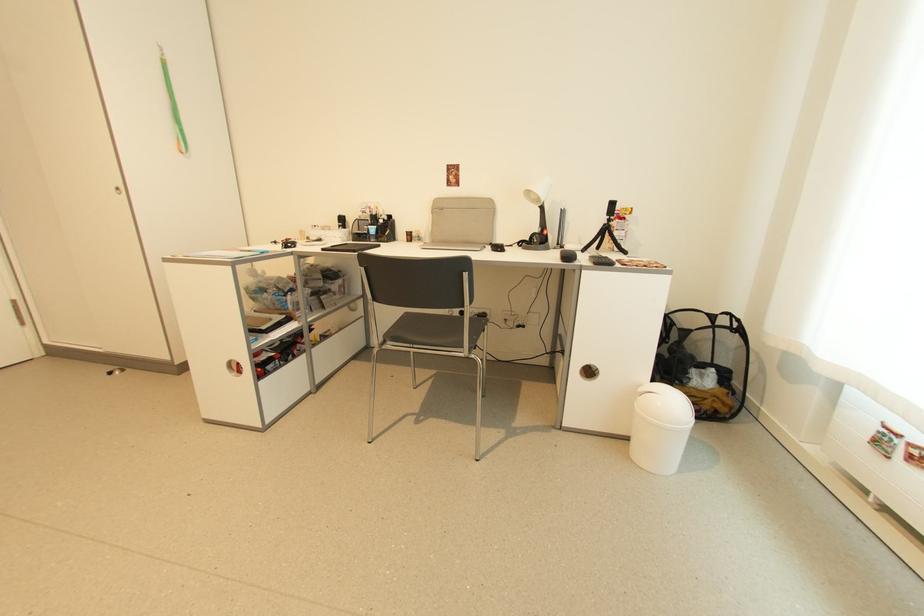
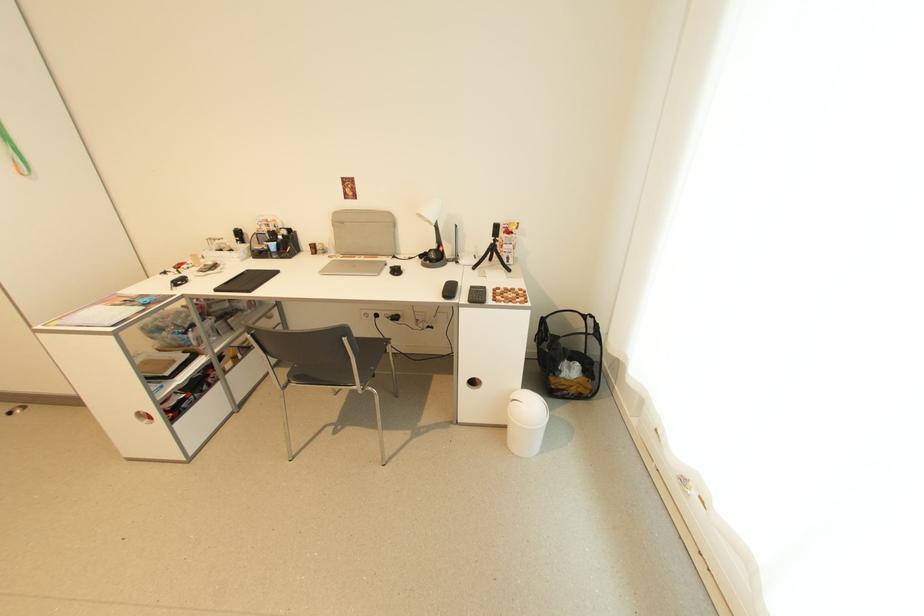
In the second image, find the point that corresponds to (x=541, y=232) in the first image.

(439, 248)